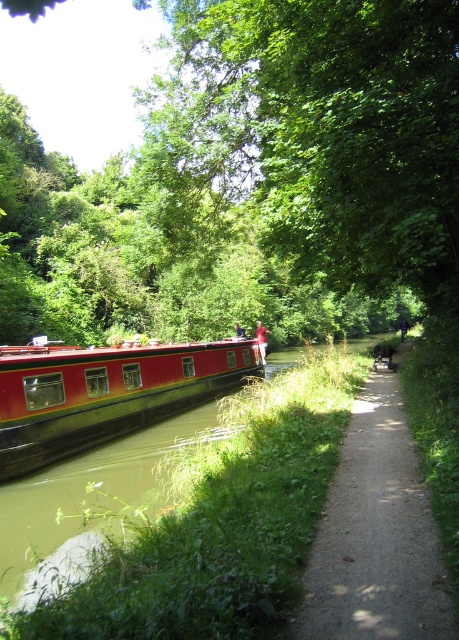
Between point (415, 532) and point (263, 362), which one is positioned behind?

The point (263, 362) is more distant.

In the scene shown: Can you confirm if dirt path at center is positioned to the left of red fabric person at center?

In fact, dirt path at center is to the right of red fabric person at center.

The width and height of the screenshot is (459, 640). Identify the location of dirt path at center. (376, 536).

Who is shorter, green leafy tree at center or blue denim shirt at center?

blue denim shirt at center is shorter.

Is point (267, 214) farther from camera compared to point (235, 323)?

No, (267, 214) is closer to viewer.

Find the location of a particular element. The image size is (459, 640). green leafy tree at center is located at coordinates (251, 182).

Find the location of `green leafy tree at center`. green leafy tree at center is located at coordinates (251, 182).

Looking at this image, which is more to the right, green leafy tree at center or red fabric person at center?

Positioned to the right is red fabric person at center.

The height and width of the screenshot is (640, 459). Describe the element at coordinates (251, 182) in the screenshot. I see `green leafy tree at center` at that location.

You are a GUI agent. You are given a task and a screenshot of the screen. Output one action in this format:
    pyautogui.click(x=<x>, y=<y>)
    Task: Click on the green leafy tree at center
    This screenshot has width=459, height=640.
    Given the screenshot: What is the action you would take?
    pyautogui.click(x=251, y=182)